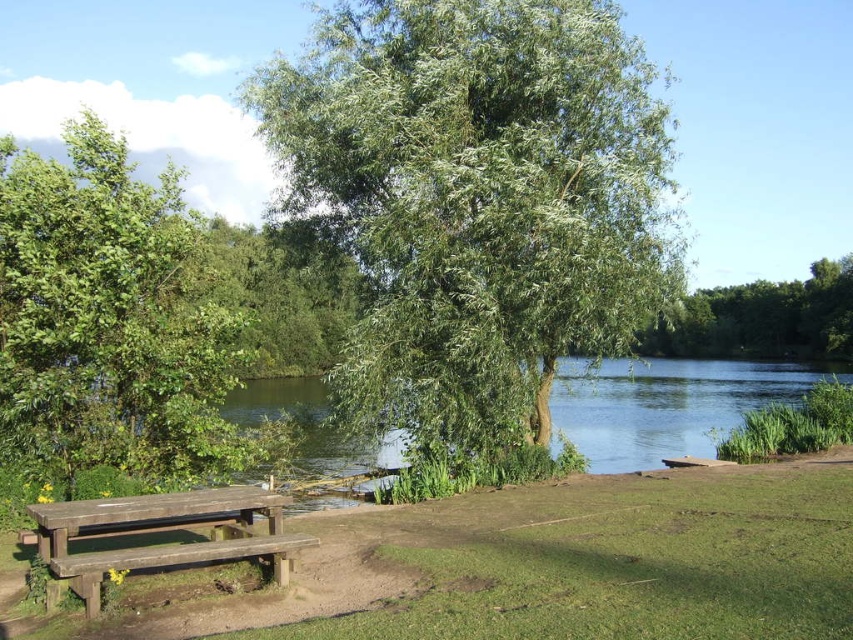
The image size is (853, 640). Describe the element at coordinates (616, 561) in the screenshot. I see `green grass at lower center` at that location.

Is green grass at lower center below green leafy tree at upper center?

Correct, green grass at lower center is located below green leafy tree at upper center.

Which is behind, point (457, 596) or point (802, 307)?

Point (802, 307)

Image resolution: width=853 pixels, height=640 pixels. I want to click on green grass at lower center, so click(x=616, y=561).

Is green leafy tree at center positioned before weathered wood picnic table at lower left?

No, green leafy tree at center is further to the viewer.

Who is shorter, green leafy tree at center or weathered wood picnic table at lower left?

weathered wood picnic table at lower left

This screenshot has height=640, width=853. What do you see at coordinates (477, 200) in the screenshot? I see `green leafy tree at center` at bounding box center [477, 200].

The height and width of the screenshot is (640, 853). Identify the location of green leafy tree at center. (477, 200).

Does green grass at lower center have a lesser width compared to weathered wood picnic table at lower left?

Incorrect, green grass at lower center's width is not less than weathered wood picnic table at lower left's.

The width and height of the screenshot is (853, 640). What are the coordinates of `green grass at lower center` in the screenshot? It's located at (616, 561).

The width and height of the screenshot is (853, 640). Find the location of `green grass at lower center`. green grass at lower center is located at coordinates (616, 561).